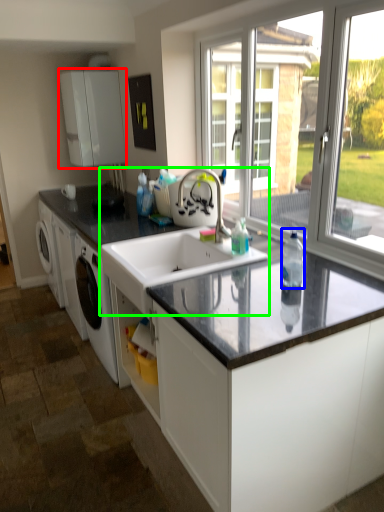
Question: Which object is the farthest from cabinetry (highlighted by a red box)? Choose among these: bottle (highlighted by a blue box) or sink (highlighted by a green box).

Choices:
 (A) bottle
 (B) sink

Answer: (A)